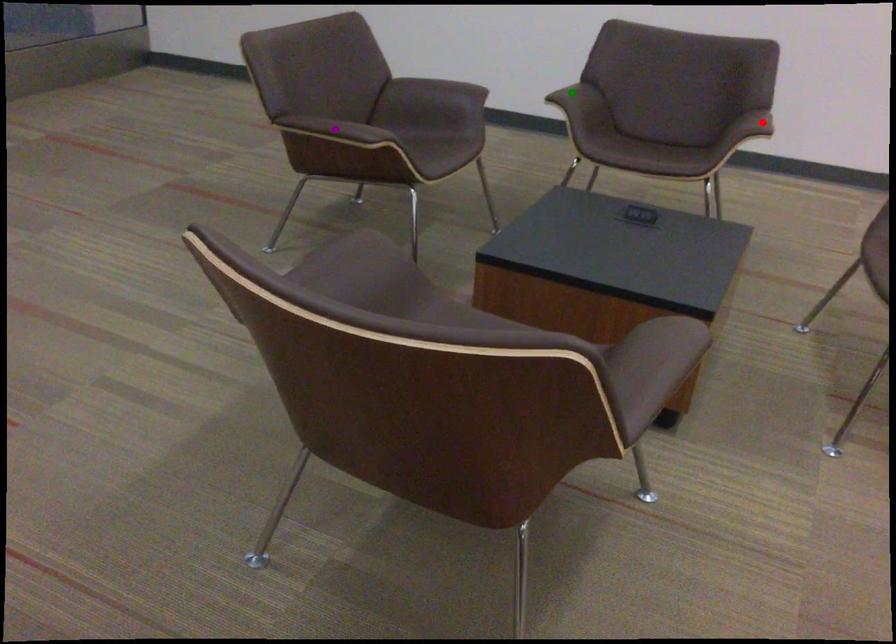
Order these from farthest to nearest:
purple point | red point | green point

red point, green point, purple point